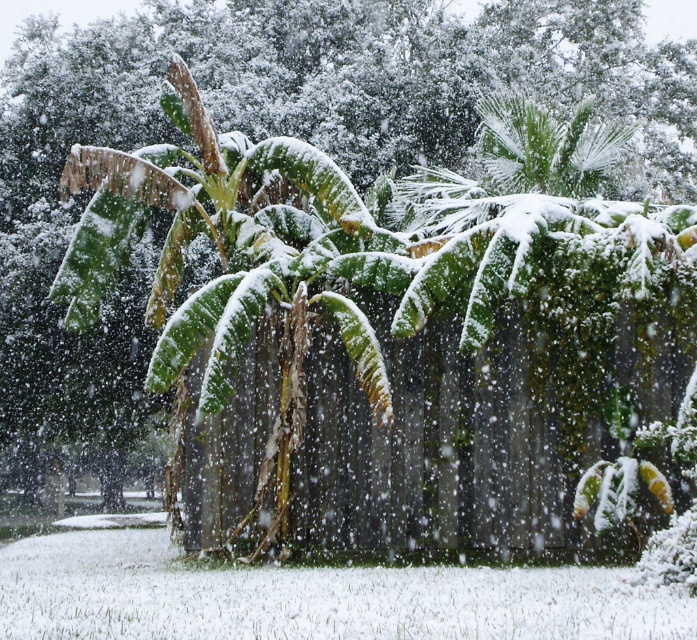
Question: Which object appears closest to the camera in this image?

Choices:
 (A) green wood fence at center
 (B) green leafy palm at center

Answer: (A)

Question: Which of the following is the farthest from the observer?

Choices:
 (A) (383, 252)
 (B) (597, 442)

Answer: (B)

Question: Is green wood fence at center below green leafy palm at center?

Choices:
 (A) no
 (B) yes

Answer: (B)

Question: Observing the image, what is the correct spatial positioning of green wood fence at center in reference to green leafy palm at center?

Choices:
 (A) above
 (B) below

Answer: (B)

Question: Is green wood fence at center in front of green leafy palm at center?

Choices:
 (A) yes
 (B) no

Answer: (A)